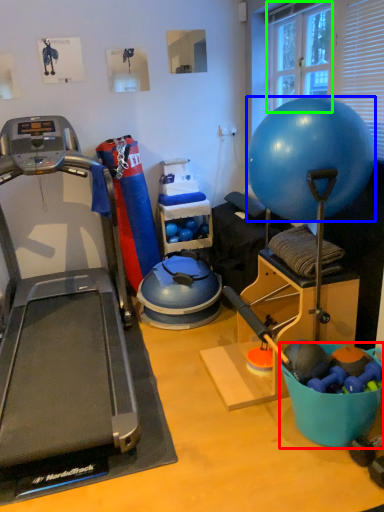
Question: Which is farther away from bowl (highlighted by a red box)? ball (highlighted by a blue box) or window screen (highlighted by a green box)?

Choices:
 (A) ball
 (B) window screen

Answer: (B)